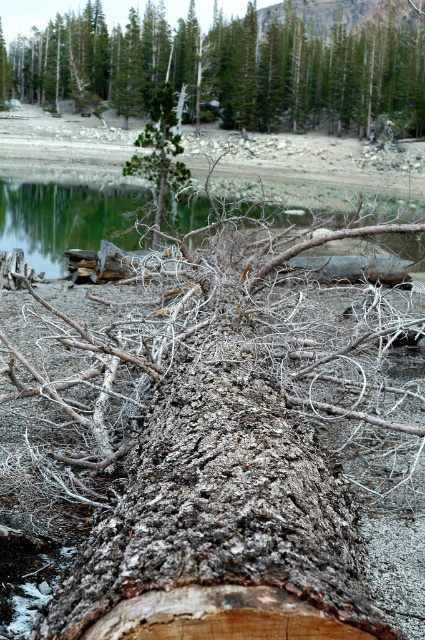
You are a hiker who wants to cross the fallen tree trunk. You see the gray rough bark log at center and the green matte tree at center. Which object is higher in elevation?

The gray rough bark log at center is located above the green matte tree at center, so it is higher in elevation.

You are standing at the edge of the shoreline and see the gray rough bark log at center and the clear water at center. Which object is closer to your right side?

The clear water at center is closer to your right side because the gray rough bark log at center is to the left of it.

You are standing on the rocky shoreline and want to place a small seashell exactly where the gray rough bark log at center and the clear water at center meet. Based on the scene description, where would you place the seashell?

The gray rough bark log at center is taller than clear water at center, so the seashell should be placed on top of the gray rough bark log at center where it meets the clear water at center.